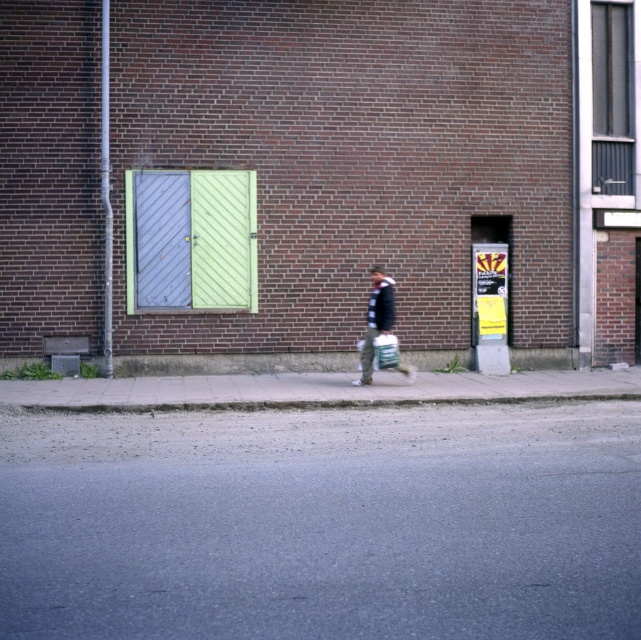
Who is shorter, dark blue jacket at center or green fabric shopping bag at center?

With less height is green fabric shopping bag at center.

Between dark blue jacket at center and green fabric shopping bag at center, which one is positioned higher?

dark blue jacket at center

This screenshot has width=641, height=640. Describe the element at coordinates (376, 317) in the screenshot. I see `dark blue jacket at center` at that location.

The width and height of the screenshot is (641, 640). What are the coordinates of `dark blue jacket at center` in the screenshot? It's located at (376, 317).

Is point (542, 618) closer to camera compared to point (383, 362)?

Yes, it is in front of point (383, 362).

This screenshot has height=640, width=641. What do you see at coordinates (322, 522) in the screenshot?
I see `gray asphalt at lower center` at bounding box center [322, 522].

Which is behind, point (385, 456) or point (376, 349)?

Point (376, 349)

The height and width of the screenshot is (640, 641). Find the location of `gray asphalt at lower center`. gray asphalt at lower center is located at coordinates (322, 522).

Can you confirm if metallic gray shutter at upper right is thinner than dark blue jacket at center?

In fact, metallic gray shutter at upper right might be wider than dark blue jacket at center.

Who is more forward, (597, 42) or (370, 339)?

Positioned in front is point (370, 339).

Identify the location of metallic gray shutter at upper right. (x=612, y=99).